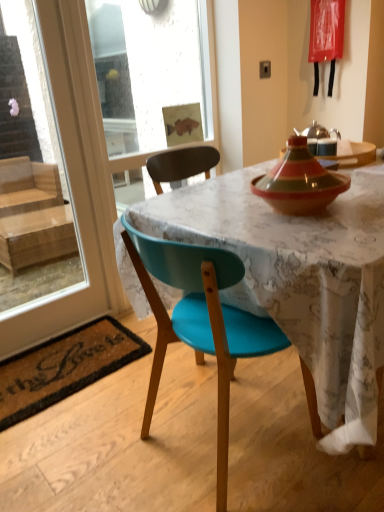
Locate an element on the screen. The image size is (384, 512). free space to the right of coir mat at lower left is located at coordinates (169, 390).